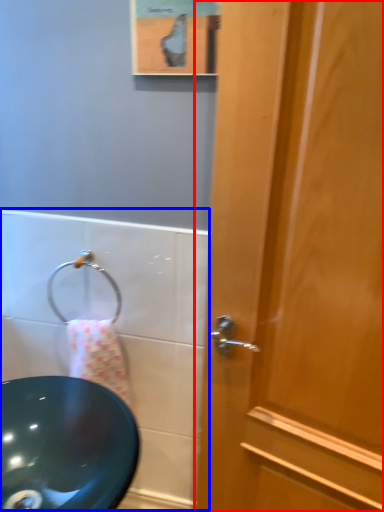
Question: Which of the following is the farthest to the observer, door (highlighted by a red box) or bath (highlighted by a blue box)?

Choices:
 (A) door
 (B) bath

Answer: (B)